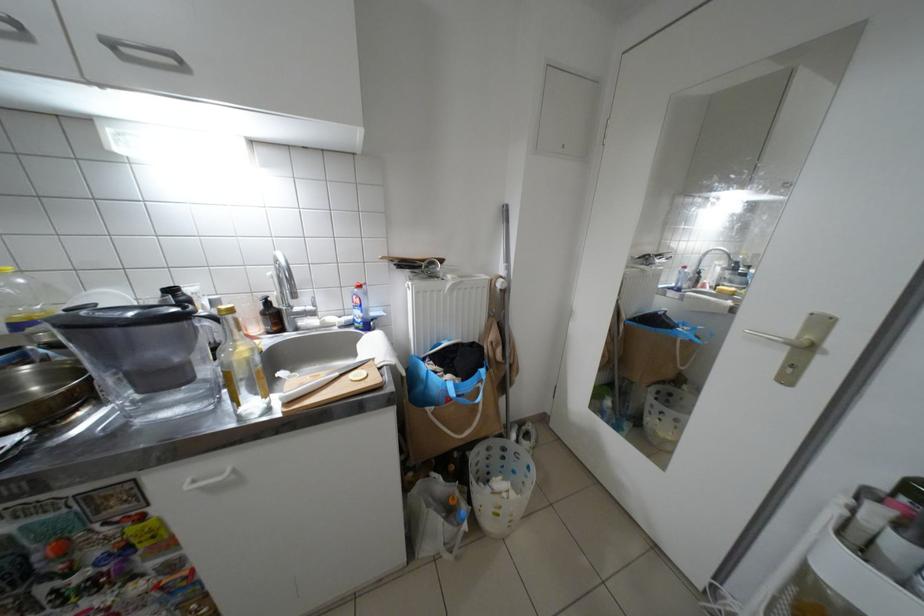
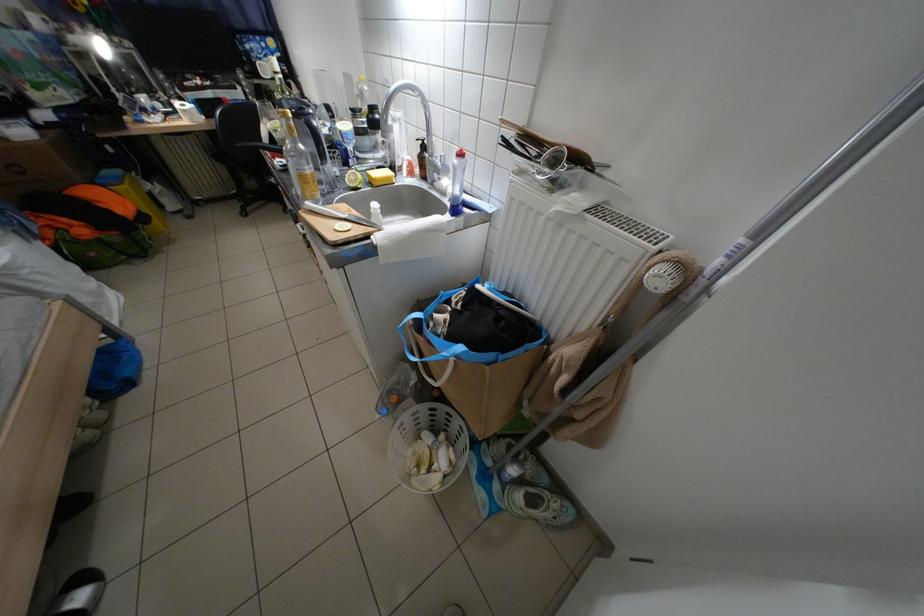
The first image is from the beginning of the video and the second image is from the end. How did the camera likely rotate when shooting the video?

The camera rotated toward left-down.